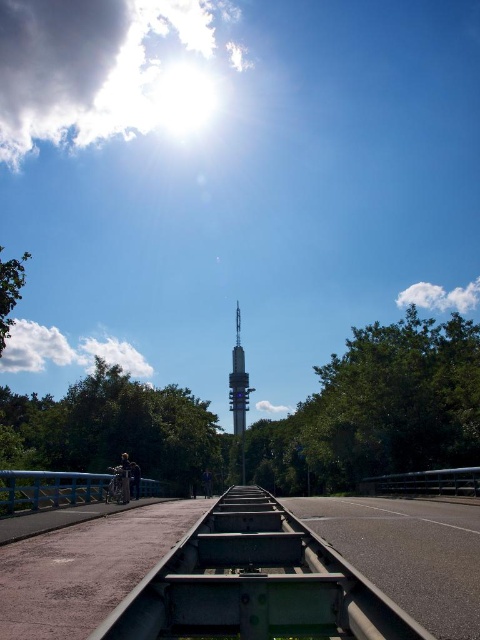
Is asphalt road at center above metallic silver tower at center?

No.

Who is lower down, asphalt road at center or metallic silver tower at center?

asphalt road at center is lower down.

Which is behind, point (420, 586) or point (247, 400)?

The point (247, 400) is behind.

Locate an element on the screen. This screenshot has height=640, width=480. asphalt road at center is located at coordinates (408, 554).

Consider the image. Does metallic gray train track at center appear on the right side of asphalt road at center?

Incorrect, metallic gray train track at center is not on the right side of asphalt road at center.

Who is lower down, metallic gray train track at center or asphalt road at center?

asphalt road at center is lower down.

Who is more forward, (356, 634) or (371, 568)?

Point (356, 634)

I want to click on metallic gray train track at center, so click(x=255, y=582).

Does point (14, 492) come in front of point (239, 323)?

Yes, it is.

What do you see at coordinates (48, 490) in the screenshot?
I see `blue painted metal rail at lower left` at bounding box center [48, 490].

The image size is (480, 640). What are the coordinates of `blue painted metal rail at lower left` in the screenshot? It's located at (48, 490).